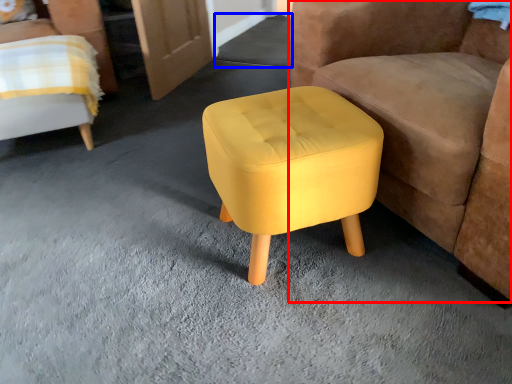
Question: Which object appears closest to the camera in this image, chair (highlighted by a red box) or concrete (highlighted by a blue box)?

Choices:
 (A) chair
 (B) concrete

Answer: (A)